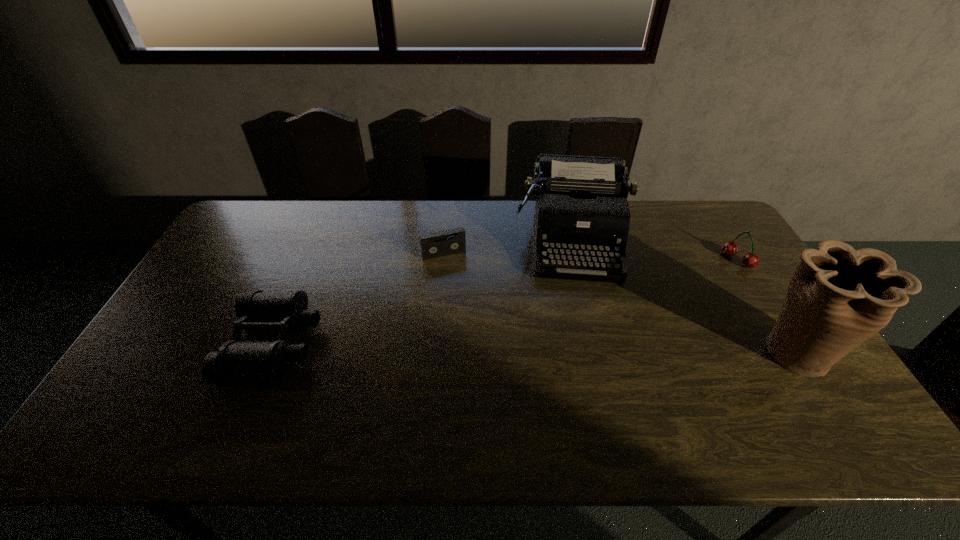
This screenshot has width=960, height=540. What are the coordinates of `binoculars` in the screenshot? It's located at (238, 362).

You are a GUI agent. You are given a task and a screenshot of the screen. Output one action in this format:
    pyautogui.click(x=<x>, y=<y>)
    Task: Click on the urn
    Image resolution: width=960 pixels, height=540 pixels.
    Given the screenshot: What is the action you would take?
    pyautogui.click(x=838, y=297)

This screenshot has width=960, height=540. Identify the location of videotape. (435, 244).

The width and height of the screenshot is (960, 540). In order to click on cherry in this screenshot , I will do `click(750, 260)`.

Where is `the second tallest object`? Image resolution: width=960 pixels, height=540 pixels. the second tallest object is located at coordinates (581, 211).

This screenshot has width=960, height=540. Find the location of `the third object from right to left`. the third object from right to left is located at coordinates (581, 211).

This screenshot has width=960, height=540. Find the location of `free space located through the eyepieces of the leftmost object`. free space located through the eyepieces of the leftmost object is located at coordinates (390, 346).

Where is `vacant area situated 0.390m on the back of the tallest object`? vacant area situated 0.390m on the back of the tallest object is located at coordinates (721, 235).

At what (x,y) coordinates should I click in order to perform the action: click on free space located on the front-facing side of the fourth object from right to left. Please return your answer as a coordinate pair (x, y). Looking at the image, I should click on (474, 323).

This screenshot has width=960, height=540. Find the location of `vacant space located on the front-facing side of the fourth object from right to left`. vacant space located on the front-facing side of the fourth object from right to left is located at coordinates (482, 343).